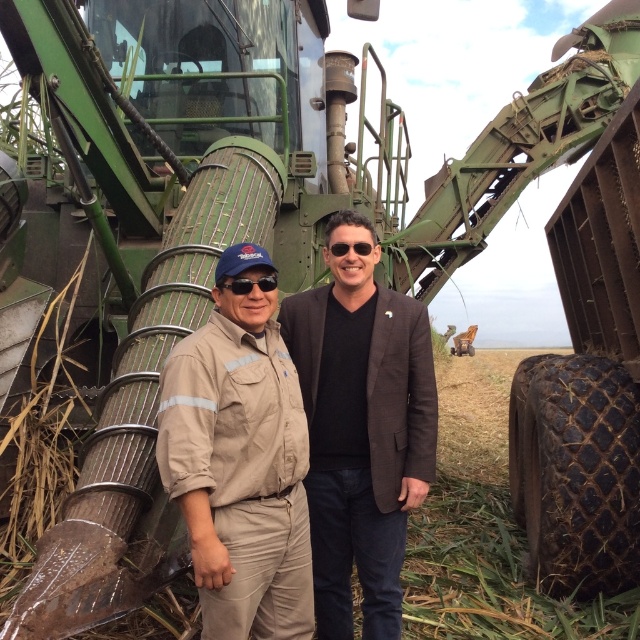
You are a safety inspector and need to ensure that the distance between the tan fabric uniform at center and the other person is at least 2 meters for safety. Can you confirm if the distance meets the requirement?

The distance between the tan fabric uniform at center and the other person is 2.49 meters, which exceeds the 2 meter requirement, so it meets the safety standard.

You are a photographer trying to capture a clear photo of both the brown fabric suit at center and the black matte sunglasses at center. Since you want to ensure both are visible in the frame, which object should you focus on first to maintain clarity, considering their positions?

The brown fabric suit at center is positioned on the right side of black matte sunglasses at center. To ensure both are in focus, you should focus on the black matte sunglasses at center first, as it is closer to the center of the frame, making it easier to adjust the focus to include the brown fabric suit at center as well.

You are a photographer trying to capture both the brown fabric suit at center and the black matte sunglasses at center in a single frame. Based on their sizes, which object should you focus on to ensure both fit in the frame?

The brown fabric suit at center is wider than the black matte sunglasses at center, so focusing on the brown fabric suit at center would ensure both fit in the frame.